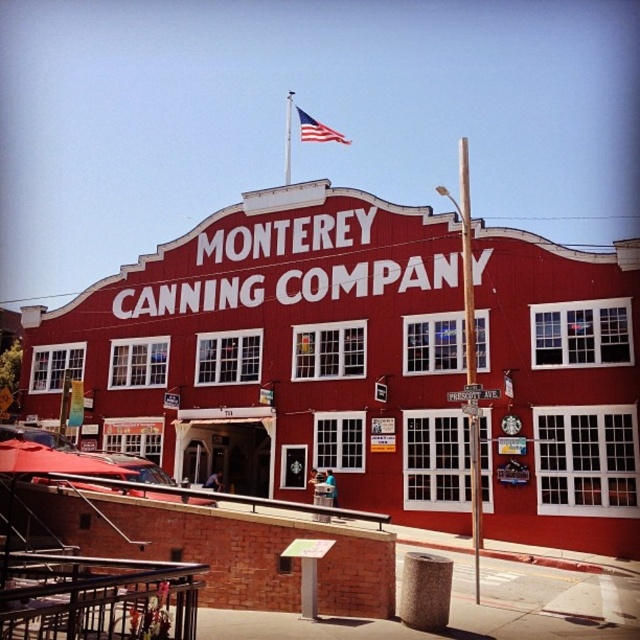
Question: Which point is closer to the camera?

Choices:
 (A) white wooden street sign at center
 (B) american flag at upper center

Answer: (A)

Question: Does american flag at upper center appear on the left side of white wooden street sign at center?

Choices:
 (A) yes
 (B) no

Answer: (A)

Question: Can you confirm if american flag at upper center is positioned above white wooden street sign at center?

Choices:
 (A) yes
 (B) no

Answer: (A)

Question: Is american flag at upper center below white wooden street sign at center?

Choices:
 (A) yes
 (B) no

Answer: (B)

Question: Which object is closer to the camera taking this photo?

Choices:
 (A) american flag at upper center
 (B) white wooden street sign at center

Answer: (B)